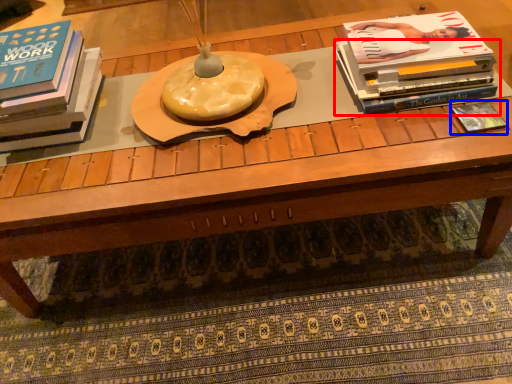
Question: Which object is closer to the camera taking this photo, book (highlighted by a red box) or book (highlighted by a blue box)?

Choices:
 (A) book
 (B) book

Answer: (B)